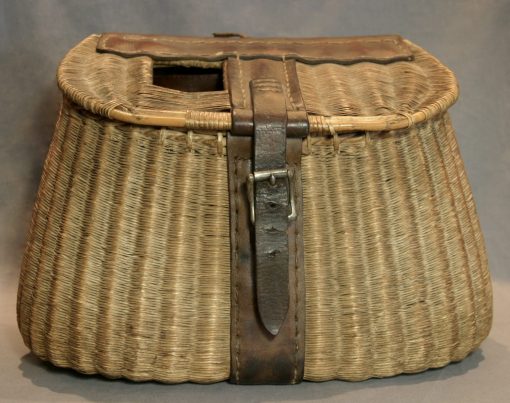
Identify the location of lid window. Image resolution: width=510 pixels, height=403 pixels. (186, 84).